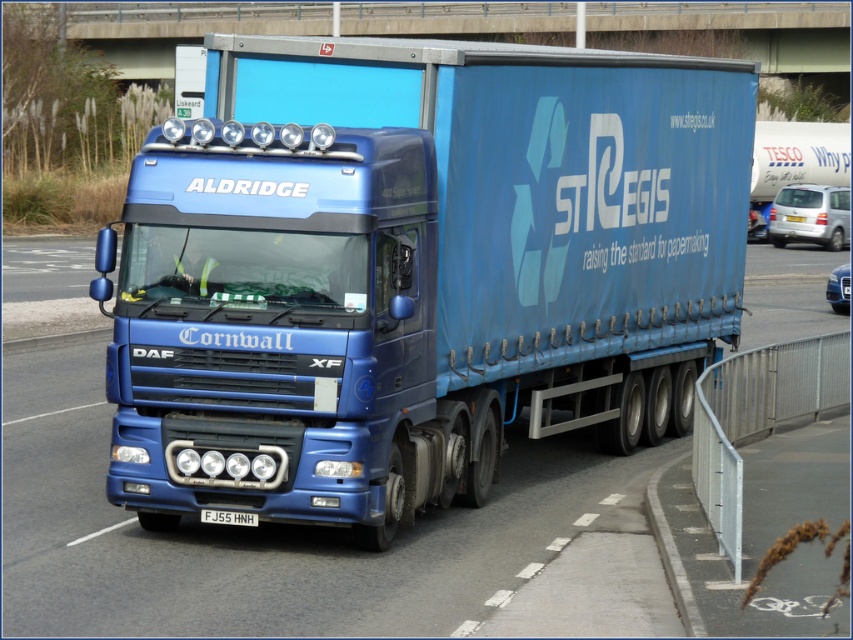
In the scene shown: Is blue metallic truck at center above white plastic license plate at center?

Indeed, blue metallic truck at center is positioned over white plastic license plate at center.

Who is taller, blue metallic truck at center or white plastic license plate at center?

With more height is blue metallic truck at center.

What do you see at coordinates (268, 532) in the screenshot? I see `blue metallic truck at center` at bounding box center [268, 532].

Identify the location of blue metallic truck at center. Image resolution: width=853 pixels, height=640 pixels. (268, 532).

Is matte blue trailer truck at center smaller than blue metallic truck at center?

Yes.

Is point (276, 84) farther from camera compared to point (30, 547)?

Yes, it is behind point (30, 547).

Where is `matte blue trailer truck at center`? matte blue trailer truck at center is located at coordinates (416, 269).

Is point (172, 522) closer to viewer compared to point (230, 513)?

No.

Does matte blue trailer truck at center have a lesser height compared to white plastic license plate at center?

In fact, matte blue trailer truck at center may be taller than white plastic license plate at center.

Consider the image. Who is more forward, (341,112) or (204,515)?

Point (204,515) is in front.

You are a GUI agent. You are given a task and a screenshot of the screen. Output one action in this format:
    pyautogui.click(x=<x>, y=<y>)
    Task: Click on the matte blue trailer truck at center
    
    Given the screenshot: What is the action you would take?
    pyautogui.click(x=416, y=269)